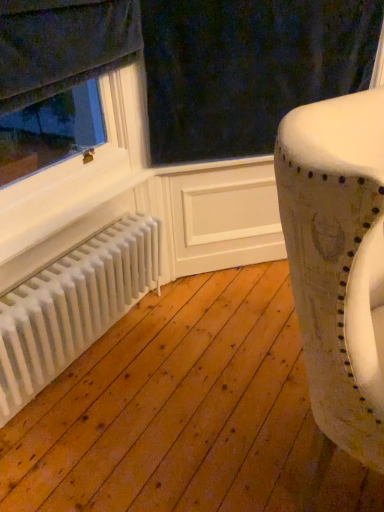
Question: From a real-world perspective, is white matte radiator at lower left located higher than distressed leather chair at right?

Choices:
 (A) yes
 (B) no

Answer: (B)

Question: Is white matte radiator at lower left taller than distressed leather chair at right?

Choices:
 (A) no
 (B) yes

Answer: (A)

Question: Are white matte radiator at lower left and distressed leather chair at right located far from each other?

Choices:
 (A) yes
 (B) no

Answer: (B)

Question: Is white matte radiator at lower left oriented towards distressed leather chair at right?

Choices:
 (A) yes
 (B) no

Answer: (A)

Question: From the image's perspective, is white matte radiator at lower left below distressed leather chair at right?

Choices:
 (A) no
 (B) yes

Answer: (B)

Question: Considering the relative sizes of white matte radiator at lower left and distressed leather chair at right in the image provided, is white matte radiator at lower left thinner than distressed leather chair at right?

Choices:
 (A) no
 (B) yes

Answer: (B)

Question: Is distressed leather chair at right bigger than white matte radiator at lower left?

Choices:
 (A) no
 (B) yes

Answer: (B)

Question: Is distressed leather chair at right positioned behind white matte radiator at lower left?

Choices:
 (A) yes
 (B) no

Answer: (B)

Question: Is distressed leather chair at right outside of white matte radiator at lower left?

Choices:
 (A) yes
 (B) no

Answer: (A)

Question: Considering the relative sizes of distressed leather chair at right and white matte radiator at lower left in the image provided, is distressed leather chair at right smaller than white matte radiator at lower left?

Choices:
 (A) yes
 (B) no

Answer: (B)

Question: Is distressed leather chair at right thinner than white matte radiator at lower left?

Choices:
 (A) yes
 (B) no

Answer: (B)

Question: Is distressed leather chair at right in front of white matte radiator at lower left?

Choices:
 (A) no
 (B) yes

Answer: (B)

Question: From a real-world perspective, is white matte radiator at lower left physically located above or below distressed leather chair at right?

Choices:
 (A) below
 (B) above

Answer: (A)